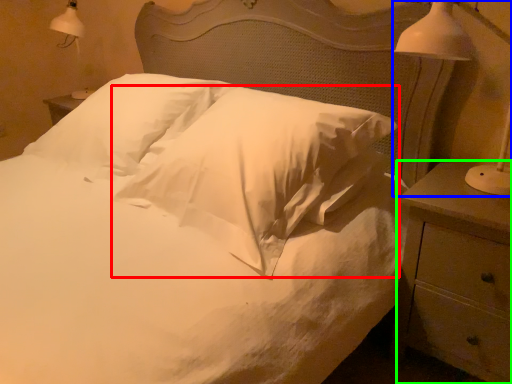
Question: Based on their relative distances, which object is farther from pillow (highlighted by a red box)? Choose from bedside lamp (highlighted by a blue box) and nightstand (highlighted by a green box).

Choices:
 (A) bedside lamp
 (B) nightstand

Answer: (A)